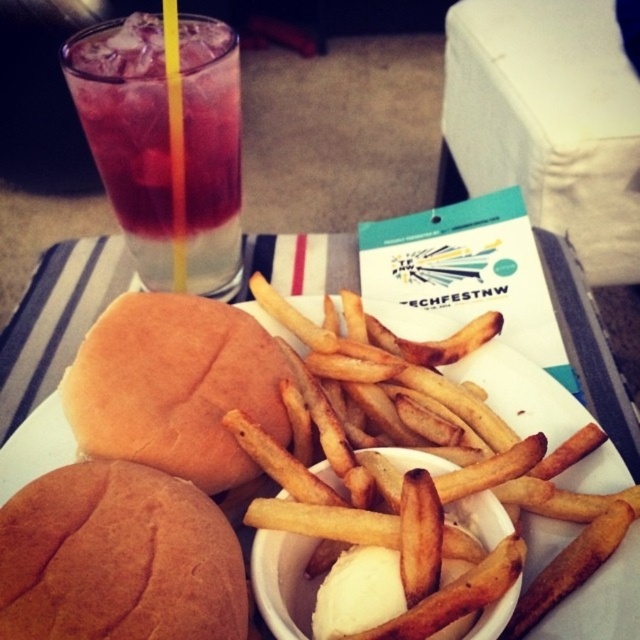
You are a photographer standing at a distance. You want to take a closeup photo of the brown soft bun at center. Based on the scene, what is the minimum distance you need to move closer to the table to ensure the bun fills the frame?

The minimum distance you need to move closer to the table is 12.24 inches to ensure the brown soft bun at center fills the frame.

You are a food delivery person who needs to place a small napkin between the brown soft bun at center and the golden crispy french fries at center. Can you fit the napkin there?

The distance between the brown soft bun at center and the golden crispy french fries at center is 3.99 inches. Since a standard napkin is typically around 6 inches wide, the napkin can easily fit between them.